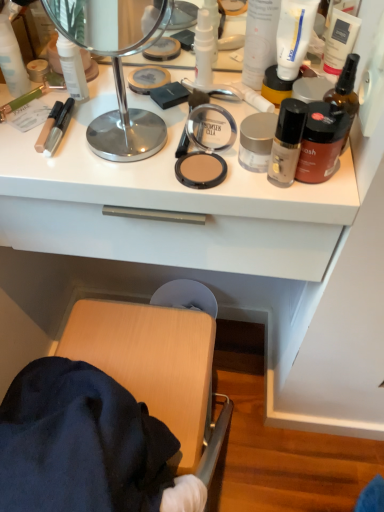
The height and width of the screenshot is (512, 384). What are the coordinates of `vacant area situated to the left side of white matte lotion at upper right, the fifth toiletry positioned from the left` in the screenshot? It's located at (161, 92).